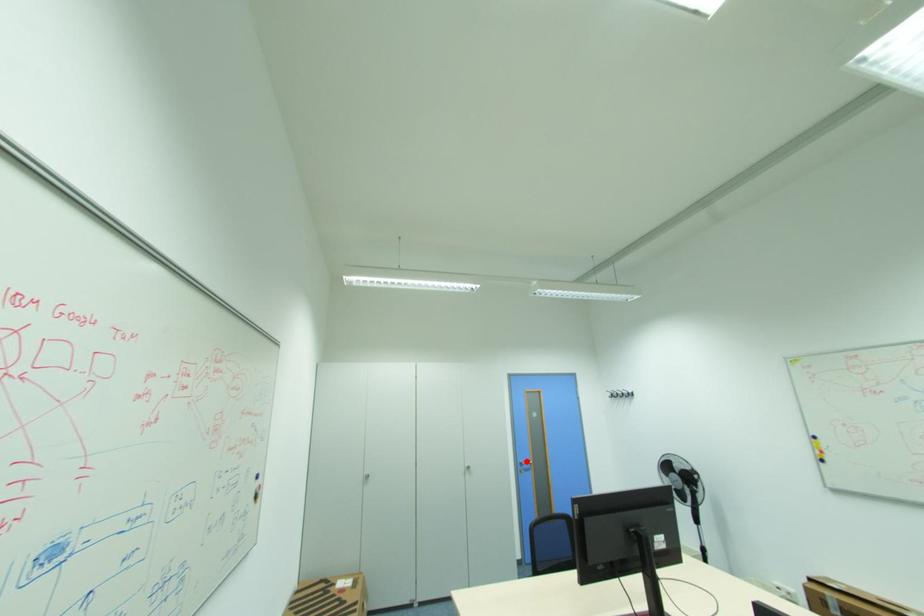
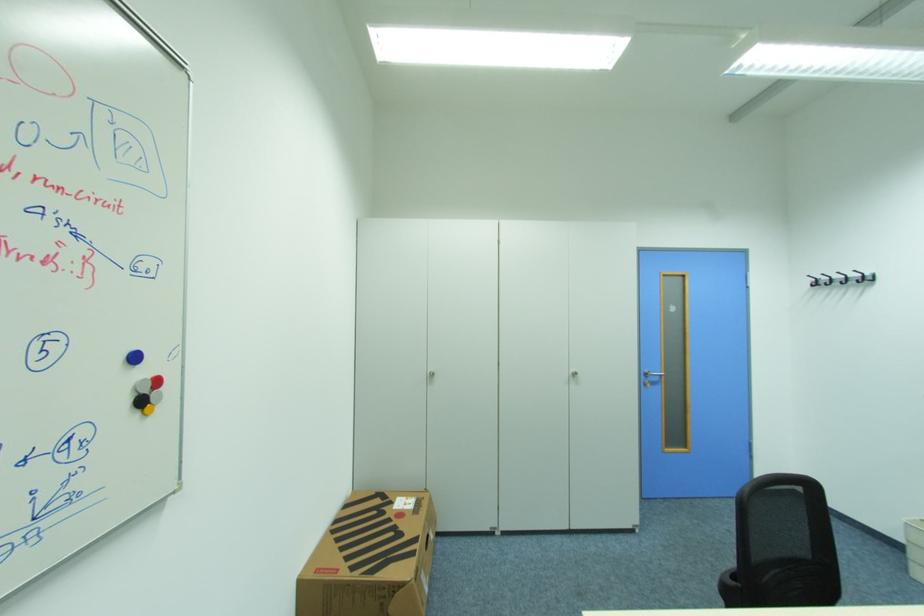
Find the pixel in the second image that matches the highlighted location in the first image.

(651, 371)